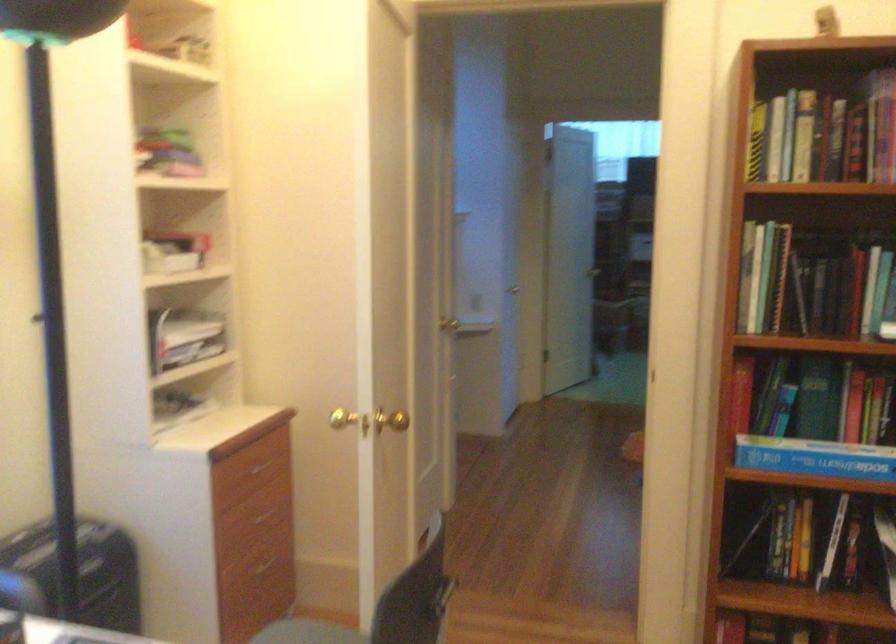
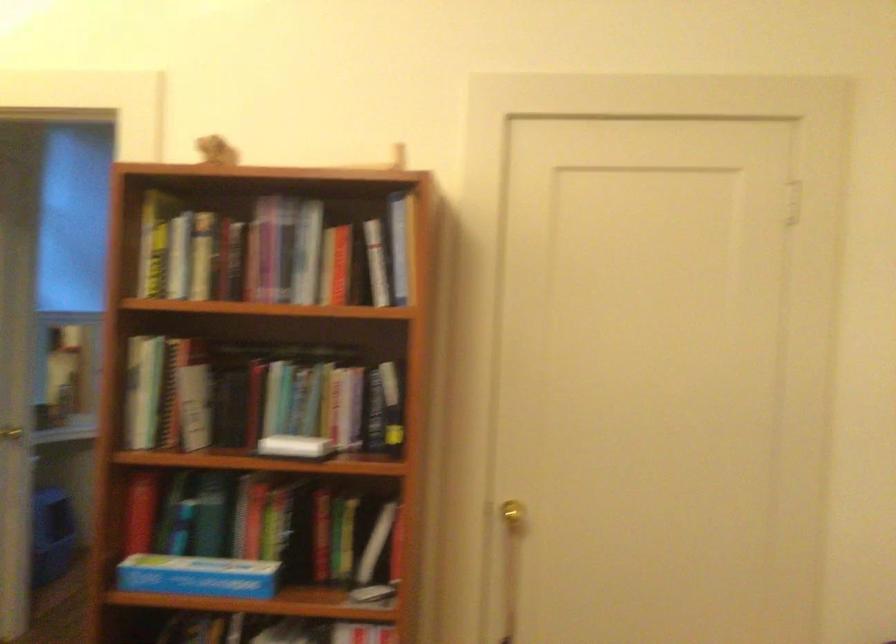
Question: In a continuous first-person perspective shot, in which direction is the camera moving?

Choices:
 (A) Left
 (B) Right
 (C) Forward
 (D) Backward

Answer: (B)